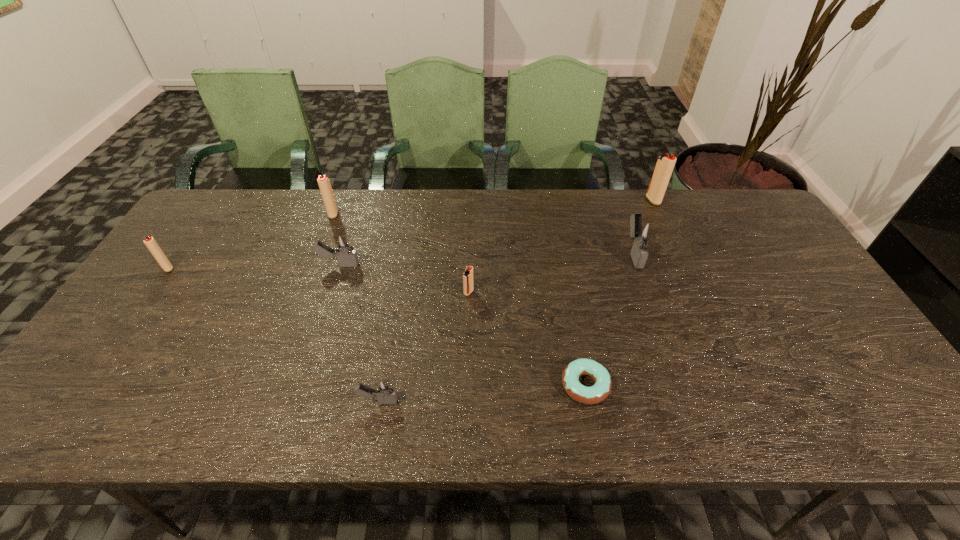
Identify the location of object that can be found as the closest to the rightmost gray igniter. The image size is (960, 540). (665, 163).

This screenshot has width=960, height=540. I want to click on igniter that is the sixth nearest to the second smallest gray igniter, so click(665, 163).

Locate an element on the screen. This screenshot has width=960, height=540. igniter identified as the fourth closest to the second biggest red igniter is located at coordinates click(x=384, y=390).

Locate which red igniter ranks third in proximity to the shortest object. Please provide its 2D coordinates. Your answer should be formatted as a tuple, i.e. [(x, y)], where the tuple contains the x and y coordinates of a point satisfying the conditions above.

[(324, 183)]

The height and width of the screenshot is (540, 960). What are the coordinates of `red igniter object that ranks as the second closest to the third object from right to left` in the screenshot? It's located at (665, 163).

Identify which gray igniter is the second nearest to the rightmost object. Please provide its 2D coordinates. Your answer should be formatted as a tuple, i.e. [(x, y)], where the tuple contains the x and y coordinates of a point satisfying the conditions above.

[(346, 255)]

Locate an element on the screen. This screenshot has height=540, width=960. gray igniter that is the second closest to the fifth object from right to left is located at coordinates (642, 232).

The width and height of the screenshot is (960, 540). I want to click on vacant space that satisfies the following two spatial constraints: 1. on the back side of the leftmost gray igniter; 2. on the right side of the leftmost object, so click(x=170, y=265).

This screenshot has width=960, height=540. Identify the location of vacant space that satisfies the following two spatial constraints: 1. on the front side of the smallest gray igniter; 2. on the right side of the sixth nearest igniter. (264, 401).